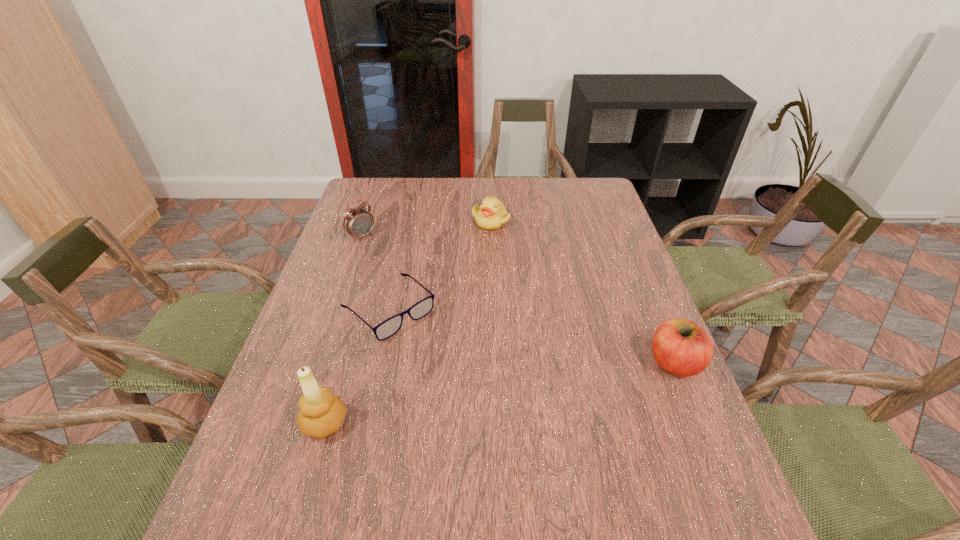
Locate an element on the screen. candle_holder is located at coordinates (321, 414).

Image resolution: width=960 pixels, height=540 pixels. I want to click on the tallest object, so (x=321, y=414).

Where is `the rightmost object`? This screenshot has height=540, width=960. the rightmost object is located at coordinates (681, 347).

I want to click on spectacles, so click(x=386, y=329).

Find the location of a particular element. The width and height of the screenshot is (960, 540). alarm clock is located at coordinates (358, 222).

Identify the location of duckling. The image size is (960, 540). (491, 215).

You are a GUI agent. You are given a task and a screenshot of the screen. Output one action in this format:
    pyautogui.click(x=<x>, y=<y>)
    Task: Click on the fourth tallest object
    The height and width of the screenshot is (540, 960).
    Given the screenshot: What is the action you would take?
    pyautogui.click(x=491, y=215)

Identify the location of vacant space located 0.100m on the back of the candle_holder. This screenshot has width=960, height=540. click(x=342, y=365).

Locate an element on the screen. The height and width of the screenshot is (540, 960). blank space located on the front of the rightmost object is located at coordinates (710, 449).

Find the location of a particular element. This screenshot has width=960, height=540. free spot located on the front-facing side of the shortest object is located at coordinates (531, 444).